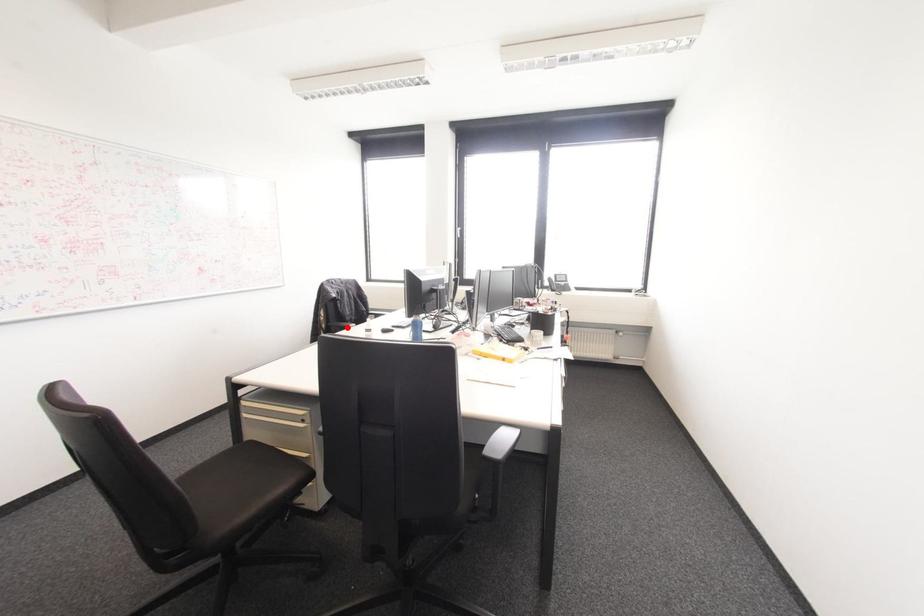
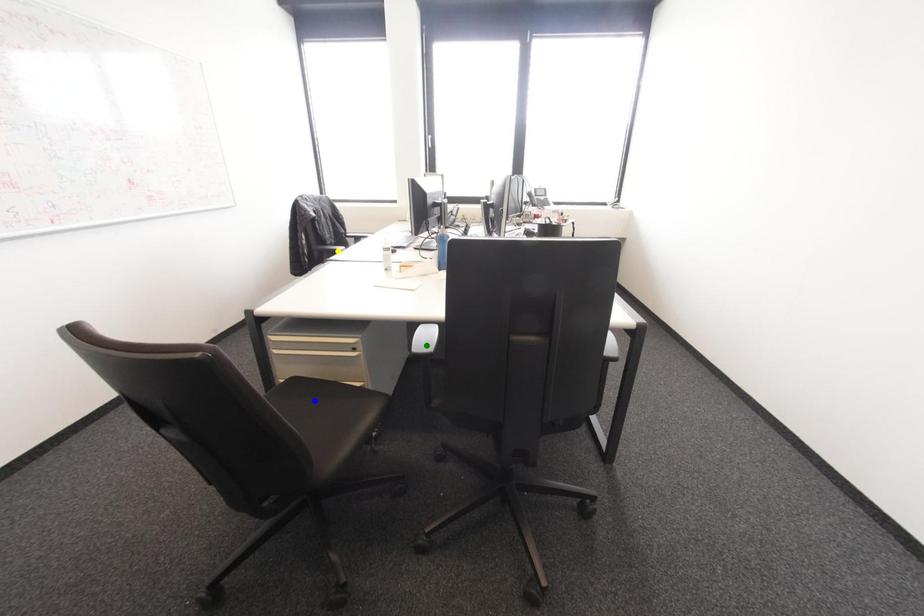
Question: I am providing you with two images of the same scene from different viewpoints. A red point is marked on the first image. You are given multiple points on the second image. In image 2, which mark is for the same physical point as the one in image 1?

Choices:
 (A) green point
 (B) yellow point
 (C) blue point

Answer: (B)